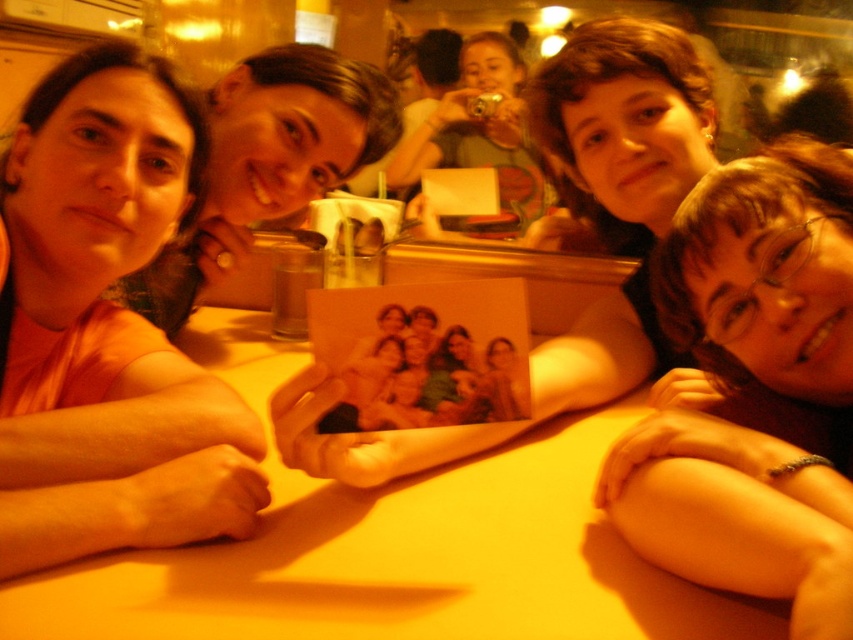
Question: Which object is closer to the camera taking this photo?

Choices:
 (A) smooth skin at lower right
 (B) matte black photo at center
 (C) yellow matte table at center
 (D) matte orange shirt at left

Answer: (A)

Question: Does matte orange shirt at left have a larger size compared to smooth skin at lower right?

Choices:
 (A) yes
 (B) no

Answer: (A)

Question: Among these objects, which one is farthest from the camera?

Choices:
 (A) smooth skin at lower right
 (B) yellow matte table at center

Answer: (B)

Question: Is matte orange shirt at left smaller than smooth skin at lower right?

Choices:
 (A) yes
 (B) no

Answer: (B)

Question: Among these points, which one is farthest from the camera?

Choices:
 (A) (256, 513)
 (B) (677, 396)

Answer: (B)

Question: Does yellow matte table at center appear on the right side of matte orange shirt at left?

Choices:
 (A) yes
 (B) no

Answer: (A)